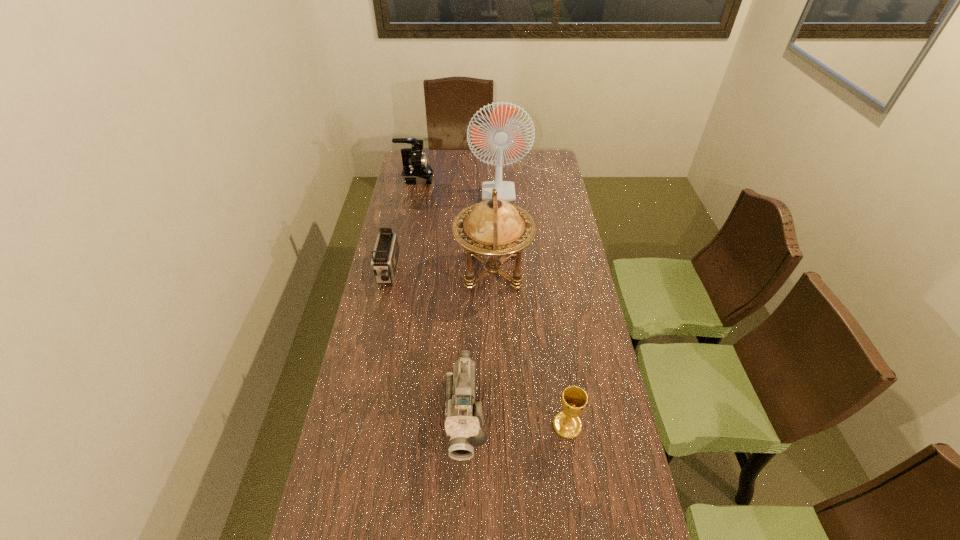
This screenshot has width=960, height=540. Find the location of `vacant region located on the lens mount of the farthest camcorder`. vacant region located on the lens mount of the farthest camcorder is located at coordinates (452, 179).

Where is `vacant space located 0.120m on the front-facing side of the nearest camcorder`? The height and width of the screenshot is (540, 960). vacant space located 0.120m on the front-facing side of the nearest camcorder is located at coordinates (463, 512).

Locate an element on the screen. The image size is (960, 540). vacant space located at the lens of the second nearest camcorder is located at coordinates (380, 308).

Identify the location of free spot located 0.060m on the left of the chalice. (532, 425).

You are a GUI agent. You are given a task and a screenshot of the screen. Output one action in this format:
    pyautogui.click(x=<x>, y=<y>)
    Task: Click on the fan that is at the far edge
    Image resolution: width=960 pixels, height=540 pixels.
    Given the screenshot: What is the action you would take?
    pyautogui.click(x=500, y=134)

The height and width of the screenshot is (540, 960). I want to click on camcorder that is at the far edge, so click(x=416, y=170).

Find the location of `fan positioned at the right edge`. fan positioned at the right edge is located at coordinates (500, 134).

Find the location of a particular element. The width and height of the screenshot is (960, 540). chalice that is positioned at the right edge is located at coordinates (574, 400).

Where is `object positioned at the far left corner`? object positioned at the far left corner is located at coordinates (416, 170).

Where is `object present at the far right corner`? object present at the far right corner is located at coordinates pyautogui.click(x=500, y=134).